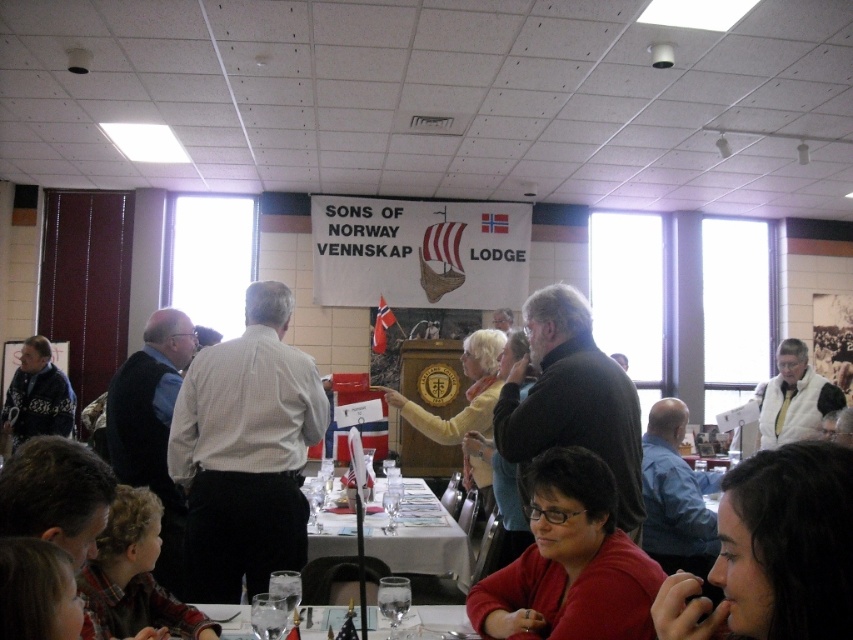
You are standing in the room and want to find the white checkered shirt at center. According to the coordinates provided, where should you look?

The white checkered shirt at center is located at coordinates point 0.708 on the x axis and 0.288 on the y axis.

Consider the image. You are organizing a photo shoot for a cultural event and need to position two props. The dark brown hair at lower right and the knitted sweater at left must be placed such that they are exactly 20 feet apart. Given their current positions, do they meet the required distance?

The dark brown hair at lower right and the knitted sweater at left are currently 18.64 feet apart, which is less than the required 20 feet. Therefore, they do not meet the required distance and need to be moved further apart.

You are standing in the room and looking at the banner. There is a point labeled as point (775, 552) in the image. What object or feature is located at this point?

The point (775, 552) corresponds to dark brown hair at lower right.